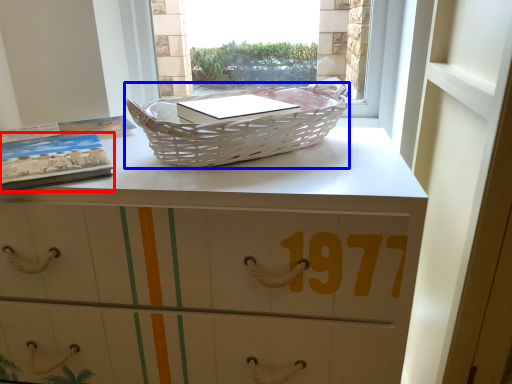
Question: Which point is further to the camera, paperback book (highlighted by a red box) or picnic basket (highlighted by a blue box)?

Choices:
 (A) paperback book
 (B) picnic basket

Answer: (A)